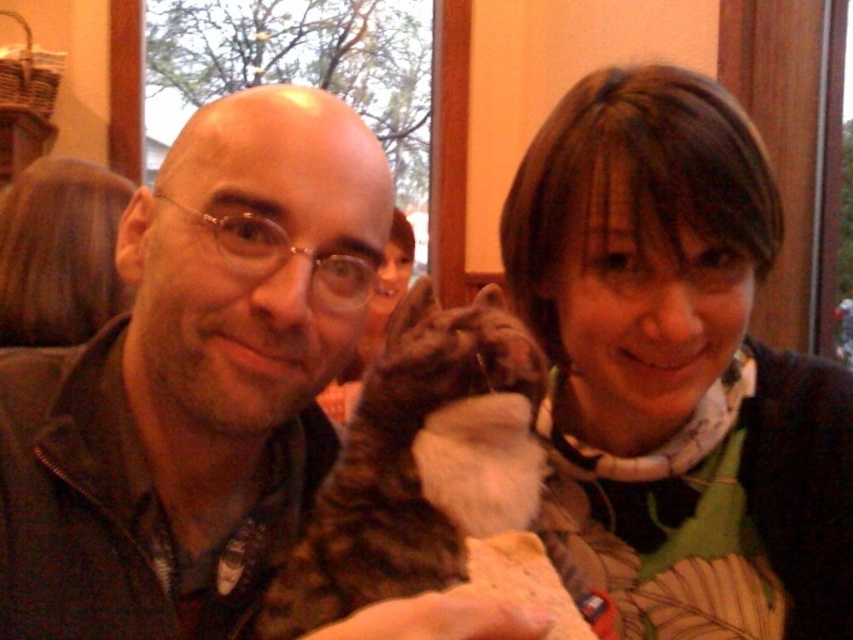
Question: Which object is farther from the camera taking this photo?

Choices:
 (A) matte brown hair at upper right
 (B) tabby fur cat at center

Answer: (A)

Question: Among these objects, which one is farthest from the camera?

Choices:
 (A) matte brown hair at upper right
 (B) tabby fur cat at center
 (C) blonde hair at upper left
 (D) matte black jacket at center

Answer: (C)

Question: Considering the relative positions of matte black jacket at center and tabby fur cat at center in the image provided, where is matte black jacket at center located with respect to tabby fur cat at center?

Choices:
 (A) below
 (B) above

Answer: (B)

Question: Can you confirm if tabby fur cat at center is bigger than blonde hair at upper left?

Choices:
 (A) yes
 (B) no

Answer: (B)

Question: Can you confirm if matte brown hair at upper right is bigger than tabby fur cat at center?

Choices:
 (A) yes
 (B) no

Answer: (A)

Question: Estimate the real-world distances between objects in this image. Which object is farther from the matte black jacket at center?

Choices:
 (A) tabby fur cat at center
 (B) matte brown hair at upper right

Answer: (B)